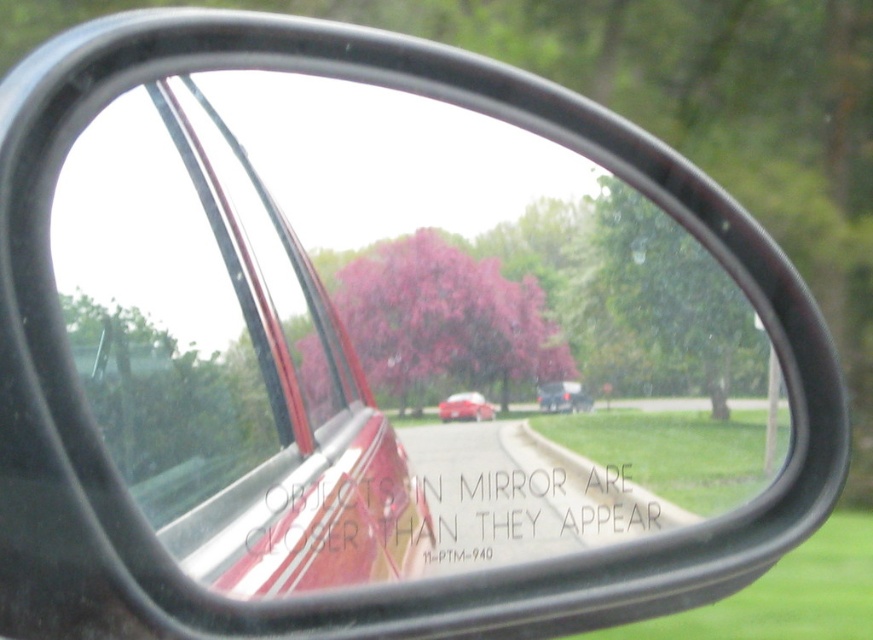
Question: Among these points, which one is farthest from the camera?

Choices:
 (A) click(485, 417)
 (B) click(560, 397)
 (C) click(476, 481)
 (D) click(471, 289)

Answer: (B)

Question: Considering the relative positions of white paper at center and matte black sedan at center in the image provided, where is white paper at center located with respect to matte black sedan at center?

Choices:
 (A) below
 (B) above

Answer: (A)

Question: Which object is the farthest from the matte black sedan at center?

Choices:
 (A) pink matte tree at center
 (B) matte red car at center
 (C) white paper at center

Answer: (A)

Question: Among these objects, which one is farthest from the camera?

Choices:
 (A) white paper at center
 (B) pink matte tree at center
 (C) matte black sedan at center
 (D) matte red car at center

Answer: (C)

Question: Is pink matte tree at center behind matte black sedan at center?

Choices:
 (A) no
 (B) yes

Answer: (A)

Question: Is matte black sedan at center bigger than matte red car at center?

Choices:
 (A) no
 (B) yes

Answer: (B)